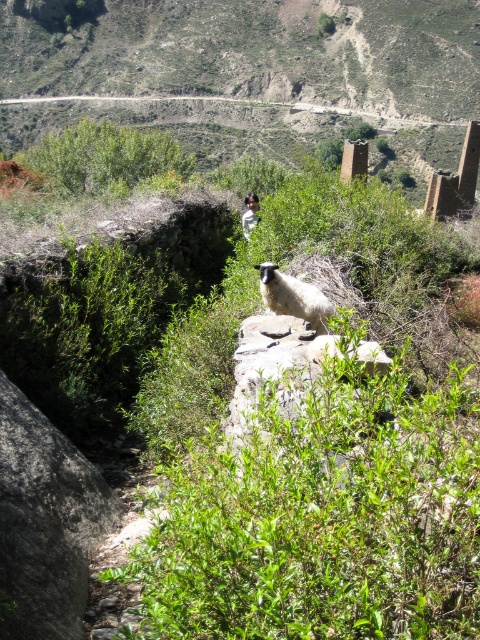
Question: Which of the following is the farthest from the observer?

Choices:
 (A) (308, 618)
 (B) (319, 310)

Answer: (B)

Question: Considering the real-world distances, which object is closest to the green leafy shrub at center?

Choices:
 (A) white woolly sheep at center
 (B) green leafy bush at upper center

Answer: (A)

Question: Can you confirm if green leafy shrub at center is wider than white woolly sheep at center?

Choices:
 (A) yes
 (B) no

Answer: (A)

Question: Does green leafy shrub at center have a lesser width compared to green leafy bush at upper center?

Choices:
 (A) no
 (B) yes

Answer: (B)

Question: Does green leafy shrub at center have a lesser width compared to white woolly sheep at center?

Choices:
 (A) yes
 (B) no

Answer: (B)

Question: Among these objects, which one is nearest to the camera?

Choices:
 (A) green leafy bush at upper center
 (B) white woolly sheep at center

Answer: (B)